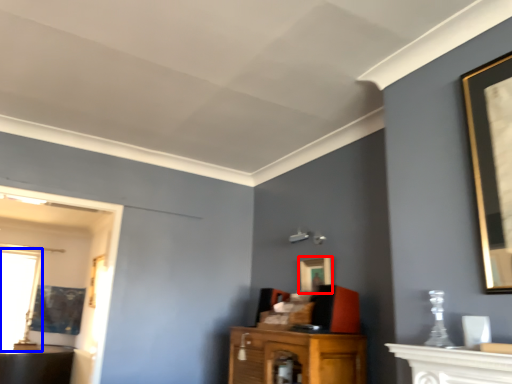
Question: Which of the following is the closest to the observer, picture frame (highlighted by a red box) or window (highlighted by a blue box)?

Choices:
 (A) picture frame
 (B) window

Answer: (A)